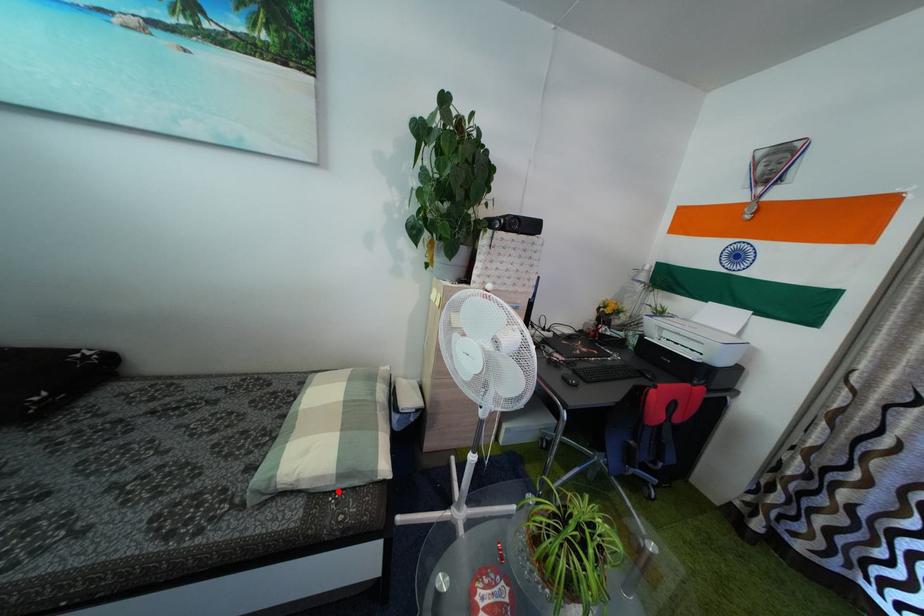
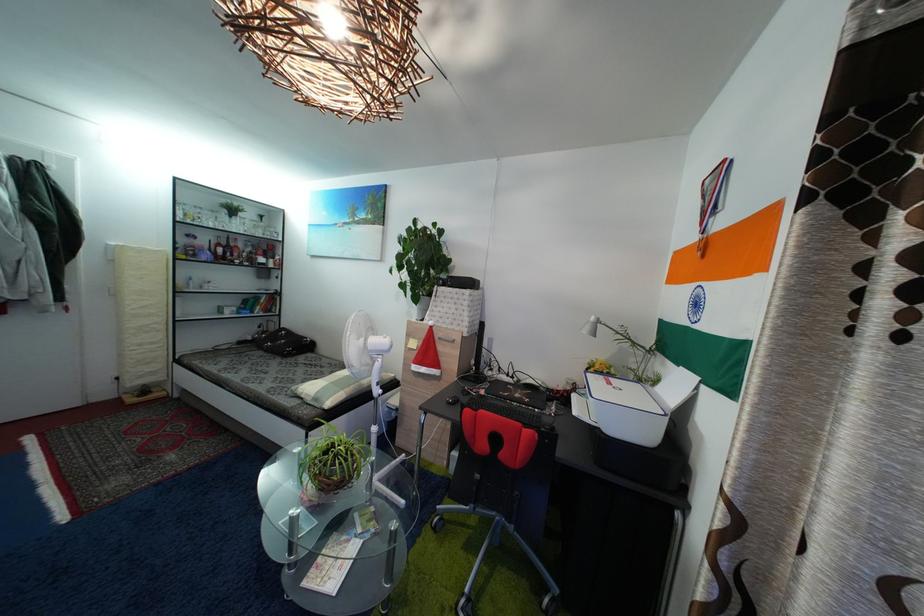
Question: A red point is marked in image1. In image2, is the corresponding 3D point closer to the camera or farther? Reply with the corresponding letter.

Choices:
 (A) The corresponding 3D point is closer.
 (B) The corresponding 3D point is farther.

Answer: (B)